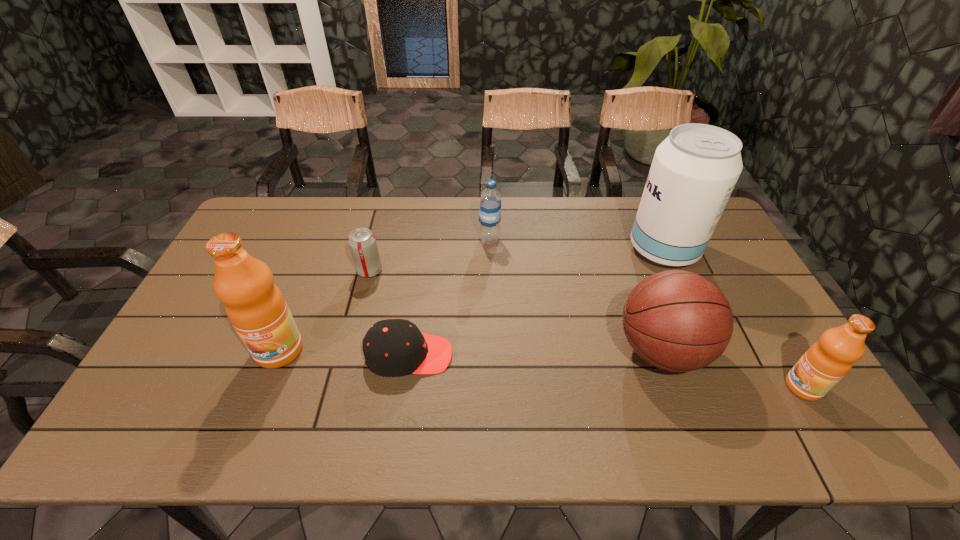
At what (x,y) coordinates should I click in order to perform the action: click on the leftmost object. Please return your answer as a coordinate pair (x, y). This screenshot has width=960, height=540. Looking at the image, I should click on (255, 306).

You are a GUI agent. You are given a task and a screenshot of the screen. Output one action in this format:
    pyautogui.click(x=<x>, y=<y>)
    Task: Click on the farther fruit juice
    The width and height of the screenshot is (960, 540).
    Given the screenshot: What is the action you would take?
    pyautogui.click(x=255, y=306)

I want to click on the right fruit juice, so click(827, 361).

This screenshot has width=960, height=540. In order to click on the rightmost object in this screenshot , I will do `click(827, 361)`.

Image resolution: width=960 pixels, height=540 pixels. In order to click on the fourth object from left to right in this screenshot , I will do `click(490, 199)`.

The width and height of the screenshot is (960, 540). Find the location of `alcohol`. alcohol is located at coordinates (694, 170).

Where is `soda can`? The height and width of the screenshot is (540, 960). soda can is located at coordinates (362, 242).

The width and height of the screenshot is (960, 540). I want to click on the second object from left to right, so click(x=362, y=242).

What are the coordinates of `cap` in the screenshot? It's located at (393, 347).

Locate an element on the screen. the shortest object is located at coordinates (393, 347).